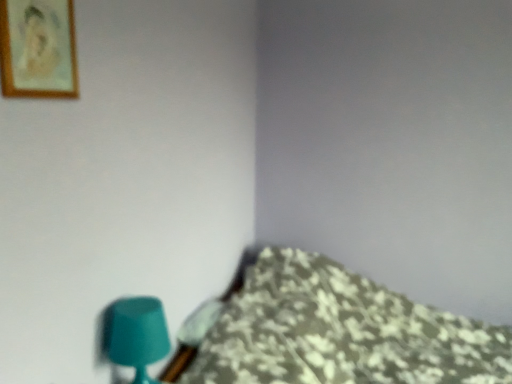
This screenshot has width=512, height=384. Describe the element at coordinates (335, 331) in the screenshot. I see `floral fabric bedspread at lower right` at that location.

You are a GUI agent. You are given a task and a screenshot of the screen. Output one action in this format:
    pyautogui.click(x=<x>, y=<y>)
    Task: Click on the teal matte table lamp at lower left
    This screenshot has height=384, width=512.
    Given the screenshot: What is the action you would take?
    pyautogui.click(x=134, y=335)

From the image's perspective, relative to teal matte table lamp at lower left, is wooden framed portrait at upper left above or below?

wooden framed portrait at upper left is above teal matte table lamp at lower left.

Is wooden framed portrait at upper left to the right of teal matte table lamp at lower left from the viewer's perspective?

No.

Is wooden framed portrait at upper left touching teal matte table lamp at lower left?

No.

From a real-world perspective, which is physically below, wooden framed portrait at upper left or teal matte table lamp at lower left?

teal matte table lamp at lower left is physically lower.

From a real-world perspective, does floral fabric bedspread at lower right sit lower than wooden framed portrait at upper left?

Yes, from a real-world perspective, floral fabric bedspread at lower right is below wooden framed portrait at upper left.

From the image's perspective, is floral fabric bedspread at lower right located above wooden framed portrait at upper left?

No.

Is floral fabric bedspread at lower right oriented towards wooden framed portrait at upper left?

No, floral fabric bedspread at lower right does not turn towards wooden framed portrait at upper left.

Which point is more distant from viewer, (402, 356) or (10, 68)?

The point (402, 356) is farther.

Considering the positions of objects teal matte table lamp at lower left and wooden framed portrait at upper left in the image provided, who is behind, teal matte table lamp at lower left or wooden framed portrait at upper left?

Positioned behind is teal matte table lamp at lower left.

Choose the correct answer: Is teal matte table lamp at lower left inside wooden framed portrait at upper left or outside it?

teal matte table lamp at lower left is not enclosed by wooden framed portrait at upper left.

Does teal matte table lamp at lower left have a larger size compared to wooden framed portrait at upper left?

Correct, teal matte table lamp at lower left is larger in size than wooden framed portrait at upper left.

From a real-world perspective, relative to floral fabric bedspread at lower right, is wooden framed portrait at upper left vertically above or below?

From a real-world perspective, wooden framed portrait at upper left is physically above floral fabric bedspread at lower right.

How different are the orientations of wooden framed portrait at upper left and floral fabric bedspread at lower right in degrees?

wooden framed portrait at upper left and floral fabric bedspread at lower right are facing 0.0325 degrees away from each other.

This screenshot has height=384, width=512. What are the coordinates of `furniture below the wooden framed portrait at upper left (from a real-world perspective)` in the screenshot? It's located at (335, 331).

Which object is wider, wooden framed portrait at upper left or floral fabric bedspread at lower right?

floral fabric bedspread at lower right.

From the image's perspective, is floral fabric bedspread at lower right below teal matte table lamp at lower left?

Yes.

Would you say floral fabric bedspread at lower right is to the left or to the right of teal matte table lamp at lower left in the picture?

Based on their positions, floral fabric bedspread at lower right is located to the right of teal matte table lamp at lower left.

Is floral fabric bedspread at lower right aimed at teal matte table lamp at lower left?

No, floral fabric bedspread at lower right is not oriented towards teal matte table lamp at lower left.

How many degrees apart are the facing directions of floral fabric bedspread at lower right and teal matte table lamp at lower left?

2.27 degrees.

Is point (117, 317) farther from camera compared to point (245, 373)?

No, it is not.

Is teal matte table lamp at lower left inside or outside of floral fabric bedspread at lower right?

teal matte table lamp at lower left is not enclosed by floral fabric bedspread at lower right.

Is teal matte table lamp at lower left in contact with floral fabric bedspread at lower right?

teal matte table lamp at lower left is not next to floral fabric bedspread at lower right, and they're not touching.

Consider the image. Does teal matte table lamp at lower left have a lesser height compared to floral fabric bedspread at lower right?

Yes.

In order to click on picture frame that is above the teal matte table lamp at lower left (from a real-world perspective) in this screenshot , I will do `click(38, 48)`.

This screenshot has height=384, width=512. In order to click on furniture below the wooden framed portrait at upper left (from a real-world perspective) in this screenshot , I will do `click(335, 331)`.

Which object lies nearer to the anchor point floral fabric bedspread at lower right, wooden framed portrait at upper left or teal matte table lamp at lower left?

teal matte table lamp at lower left is positioned closer to the anchor floral fabric bedspread at lower right.

In the scene shown: Based on their spatial positions, is teal matte table lamp at lower left or wooden framed portrait at upper left further from floral fabric bedspread at lower right?

The object further to floral fabric bedspread at lower right is wooden framed portrait at upper left.

Based on their spatial positions, is teal matte table lamp at lower left or floral fabric bedspread at lower right further from wooden framed portrait at upper left?

Among the two, floral fabric bedspread at lower right is located further to wooden framed portrait at upper left.

Which object lies nearer to the anchor point teal matte table lamp at lower left, wooden framed portrait at upper left or floral fabric bedspread at lower right?

wooden framed portrait at upper left is closer to teal matte table lamp at lower left.

Based on their spatial positions, is floral fabric bedspread at lower right or wooden framed portrait at upper left further from teal matte table lamp at lower left?

floral fabric bedspread at lower right is further to teal matte table lamp at lower left.

Which object lies nearer to the anchor point wooden framed portrait at upper left, floral fabric bedspread at lower right or teal matte table lamp at lower left?

Based on the image, teal matte table lamp at lower left appears to be nearer to wooden framed portrait at upper left.

Where is `table lamp between wooden framed portrait at upper left and floral fabric bedspread at lower right in the up-down direction`? Image resolution: width=512 pixels, height=384 pixels. table lamp between wooden framed portrait at upper left and floral fabric bedspread at lower right in the up-down direction is located at coordinates pos(134,335).